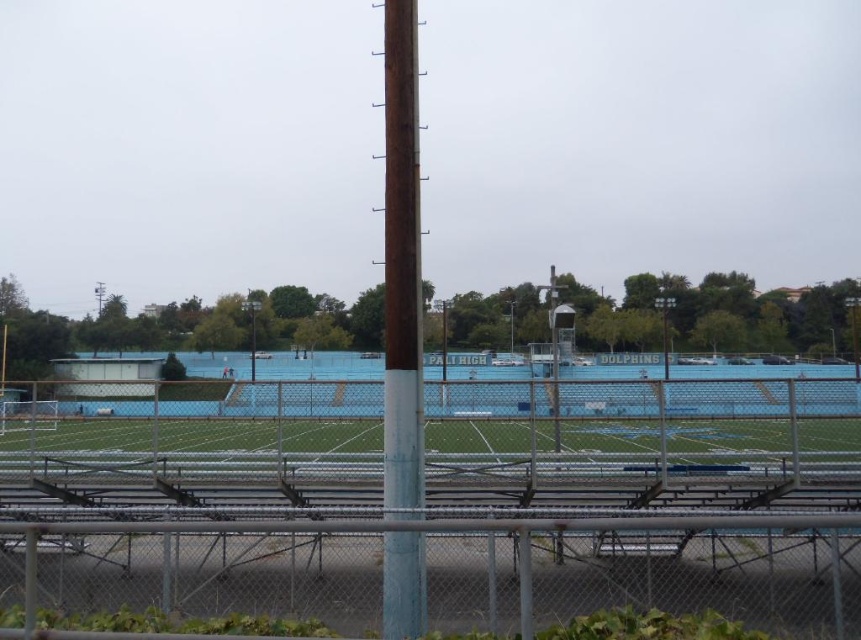
Based on the photo, you are standing at the point labeled as point (437, 509) on the image. What object are you touching?

You are touching the metallic chain link fence at center because the point (437, 509) is on it.